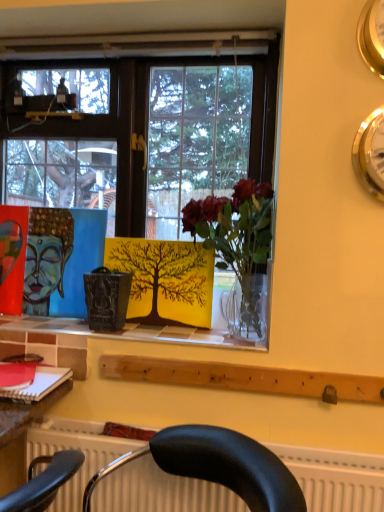
Identify the location of vacant space that is to the left of translucent glass vase at center. The image size is (384, 512). (148, 332).